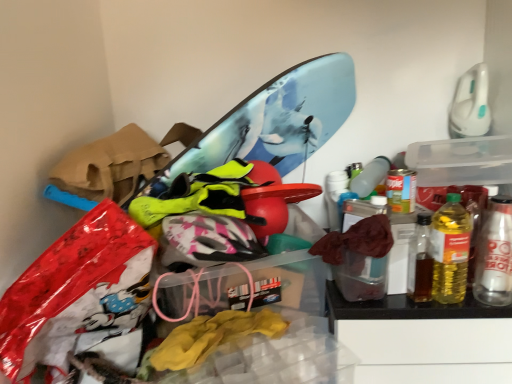
Question: In which direction should I rotate to look at transparent plastic storage box at center, the first storage box positioned from the bottom?

Choices:
 (A) right
 (B) left

Answer: (B)

Question: Considering the relative sizes of transparent plastic storage box at center, arranged as the first storage box when viewed from the left, and transparent plastic storage box at upper right, acting as the 1th storage box starting from the right, in the image provided, is transparent plastic storage box at center, arranged as the first storage box when viewed from the left, bigger than transparent plastic storage box at upper right, acting as the 1th storage box starting from the right,?

Choices:
 (A) no
 (B) yes

Answer: (B)

Question: Does transparent plastic storage box at center, the first storage box positioned from the bottom, turn towards transparent plastic storage box at upper right, positioned as the 1th storage box in top-to-bottom order?

Choices:
 (A) no
 (B) yes

Answer: (A)

Question: Is transparent plastic storage box at center, which is the 2th storage box from right to left, not within transparent plastic storage box at upper right, the second storage box from the bottom?

Choices:
 (A) yes
 (B) no

Answer: (A)

Question: Is the depth of transparent plastic storage box at center, arranged as the first storage box when viewed from the left, less than that of transparent plastic storage box at upper right, acting as the 1th storage box starting from the right?

Choices:
 (A) no
 (B) yes

Answer: (B)

Question: From the image's perspective, is transparent plastic storage box at center, which is the 2th storage box from right to left, below transparent plastic storage box at upper right, arranged as the 2th storage box when viewed from the left?

Choices:
 (A) no
 (B) yes

Answer: (B)

Question: From the image's perspective, would you say transparent plastic storage box at center, placed as the second storage box when sorted from top to bottom, is positioned over transparent plastic storage box at upper right, the second storage box from the bottom?

Choices:
 (A) no
 (B) yes

Answer: (A)

Question: Can translucent plastic bottle at right, the 1th bottle viewed from the left, be found inside metallic silver can at right, which appears as the 1th bottle when viewed from the right?

Choices:
 (A) yes
 (B) no

Answer: (B)

Question: Does metallic silver can at right, which is the second bottle from left to right, have a lesser height compared to translucent plastic bottle at right, the 2th bottle in the right-to-left sequence?

Choices:
 (A) yes
 (B) no

Answer: (A)

Question: Is metallic silver can at right, which is the second bottle from left to right, far away from translucent plastic bottle at right, the 1th bottle viewed from the left?

Choices:
 (A) no
 (B) yes

Answer: (A)

Question: From a real-world perspective, is metallic silver can at right, which appears as the 1th bottle when viewed from the right, on top of translucent plastic bottle at right, the 2th bottle in the right-to-left sequence?

Choices:
 (A) no
 (B) yes

Answer: (A)

Question: Is metallic silver can at right, which is the second bottle from left to right, oriented towards translucent plastic bottle at right, the 1th bottle viewed from the left?

Choices:
 (A) yes
 (B) no

Answer: (B)

Question: Considering the relative sizes of metallic silver can at right, which is the second bottle from left to right, and translucent plastic bottle at right, the 2th bottle in the right-to-left sequence, in the image provided, is metallic silver can at right, which is the second bottle from left to right, wider than translucent plastic bottle at right, the 2th bottle in the right-to-left sequence,?

Choices:
 (A) no
 (B) yes

Answer: (A)

Question: Is transparent plastic storage box at center, the first storage box positioned from the bottom, shorter than translucent plastic bottle at right, the 2th bottle in the right-to-left sequence?

Choices:
 (A) yes
 (B) no

Answer: (B)